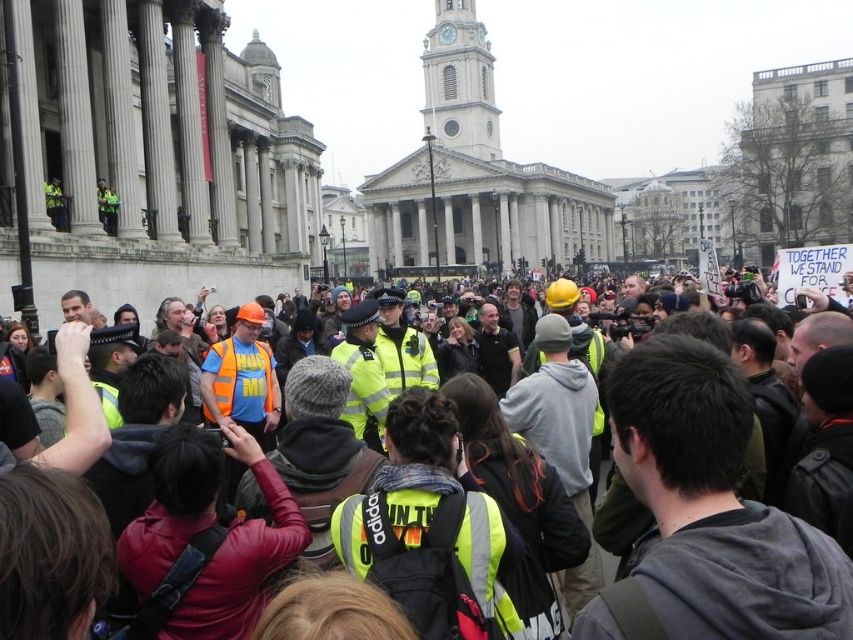
You are a participant in the event and need to locate the safety equipment. According to the image, where exactly are the yellow reflective vests at center positioned relative to the clock tower in the background?

The yellow reflective vests at center are positioned at coordinates point (715, 506) relative to the clock tower in the background.

You are a pedestrian trying to navigate through the crowd in the city square. You see two safety vests at the center of the image. Which one is closer to you, the neon yellow safety vest at center or the reflective orange safety vest at center?

The neon yellow safety vest at center is closer to you because it is in front of the reflective orange safety vest at center.